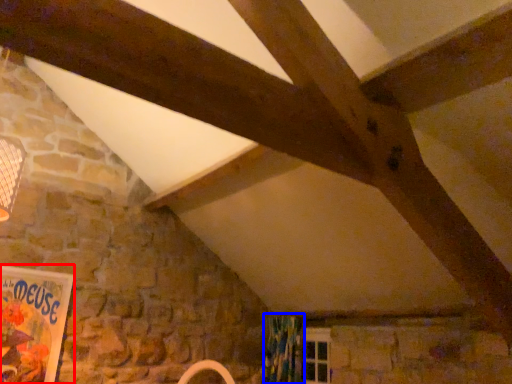
Question: Which of the following is the closest to the observer, bulletin board (highlighted by a red box) or curtain (highlighted by a blue box)?

Choices:
 (A) bulletin board
 (B) curtain

Answer: (A)